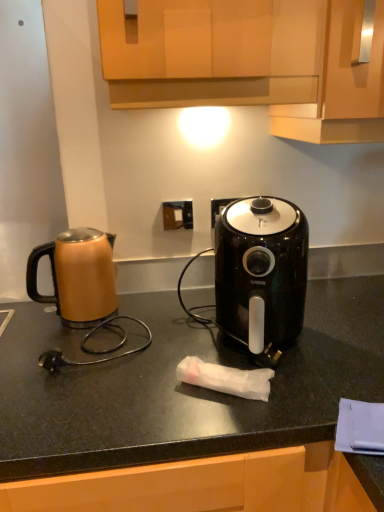
Question: Is black glossy air fryer at center directly adjacent to matte brown kettle at left?

Choices:
 (A) no
 (B) yes

Answer: (A)

Question: Is black glossy air fryer at center positioned before matte brown kettle at left?

Choices:
 (A) yes
 (B) no

Answer: (A)

Question: Is black glossy air fryer at center located outside matte brown kettle at left?

Choices:
 (A) no
 (B) yes

Answer: (B)

Question: From the image's perspective, would you say black glossy air fryer at center is positioned over matte brown kettle at left?

Choices:
 (A) yes
 (B) no

Answer: (B)

Question: Considering the relative sizes of black glossy air fryer at center and matte brown kettle at left in the image provided, is black glossy air fryer at center thinner than matte brown kettle at left?

Choices:
 (A) yes
 (B) no

Answer: (B)

Question: Is black glossy air fryer at center taller than matte brown kettle at left?

Choices:
 (A) yes
 (B) no

Answer: (A)

Question: Is black glossy air fryer at center oriented towards wooden cabinet at upper center, the second cabinetry from the left?

Choices:
 (A) yes
 (B) no

Answer: (B)

Question: From the image's perspective, is black glossy air fryer at center above wooden cabinet at upper center, which appears as the first cabinetry when viewed from the right?

Choices:
 (A) no
 (B) yes

Answer: (A)

Question: Considering the relative sizes of black glossy air fryer at center and wooden cabinet at upper center, the second cabinetry from the left, in the image provided, is black glossy air fryer at center wider than wooden cabinet at upper center, the second cabinetry from the left,?

Choices:
 (A) yes
 (B) no

Answer: (B)

Question: Is black glossy air fryer at center not close to wooden cabinet at upper center, the second cabinetry from the left?

Choices:
 (A) no
 (B) yes

Answer: (A)

Question: From a real-world perspective, is black glossy air fryer at center located higher than wooden cabinet at upper center, which appears as the first cabinetry when viewed from the right?

Choices:
 (A) no
 (B) yes

Answer: (A)

Question: Can you confirm if black glossy air fryer at center is thinner than wooden cabinet at upper center, which appears as the first cabinetry when viewed from the right?

Choices:
 (A) yes
 (B) no

Answer: (A)

Question: Is matte brown kettle at left in front of black matte countertop at center?

Choices:
 (A) no
 (B) yes

Answer: (A)